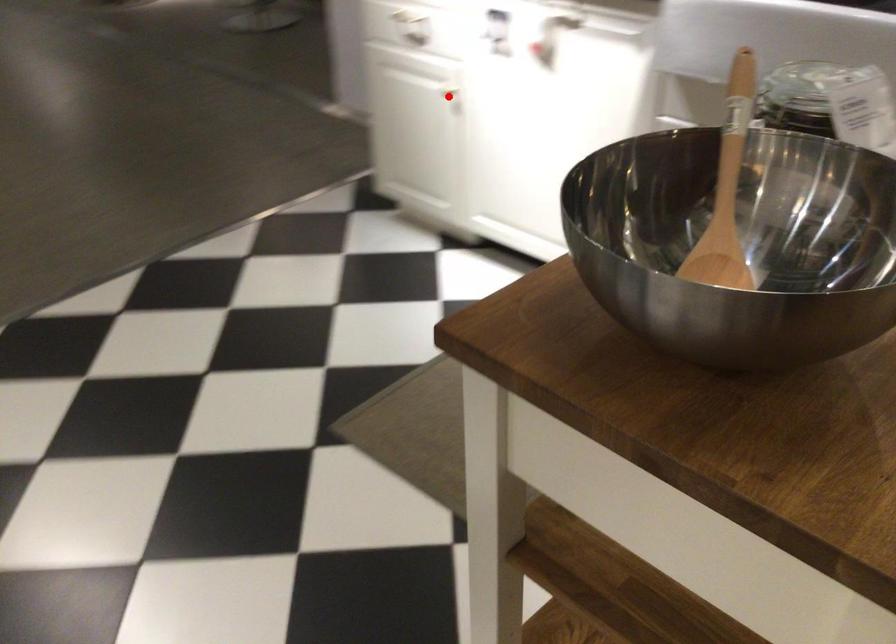
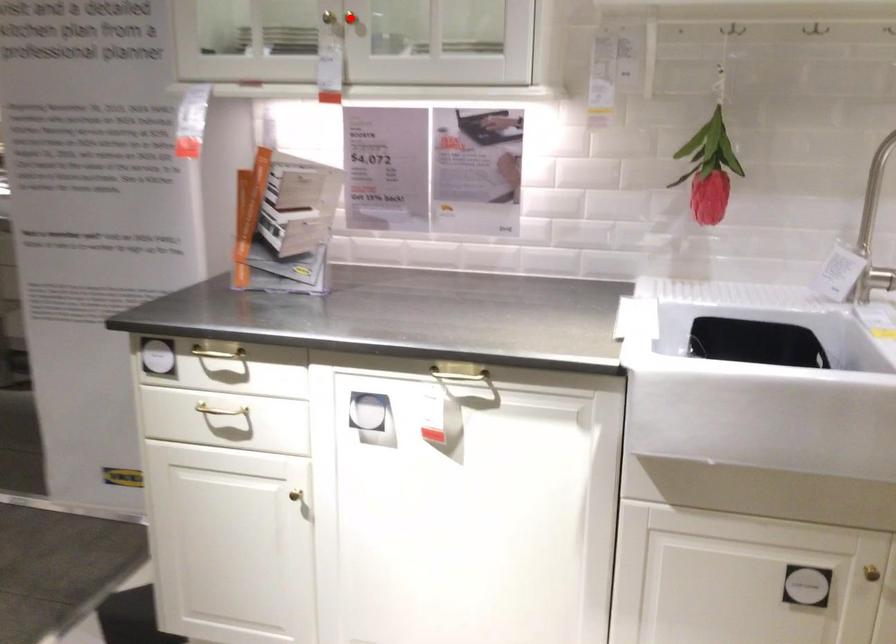
I am providing you with two images of the same scene from different viewpoints. A red point is marked on the first image and another point is marked on the second image. Is the red point in image1 aligned with the point shown in image2?

No